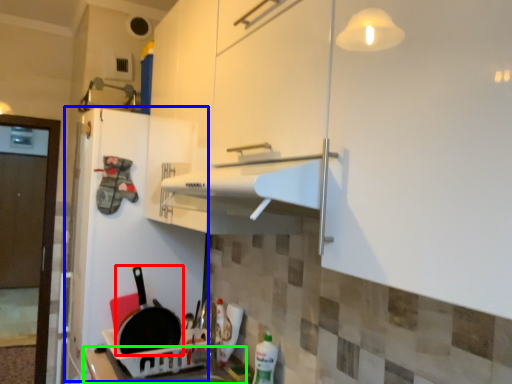
Question: Based on their relative distances, which object is farther from frying pan (highlighted by a red box)? Choose from fridge (highlighted by a blue box) and counter top (highlighted by a green box).

Choices:
 (A) fridge
 (B) counter top

Answer: (A)